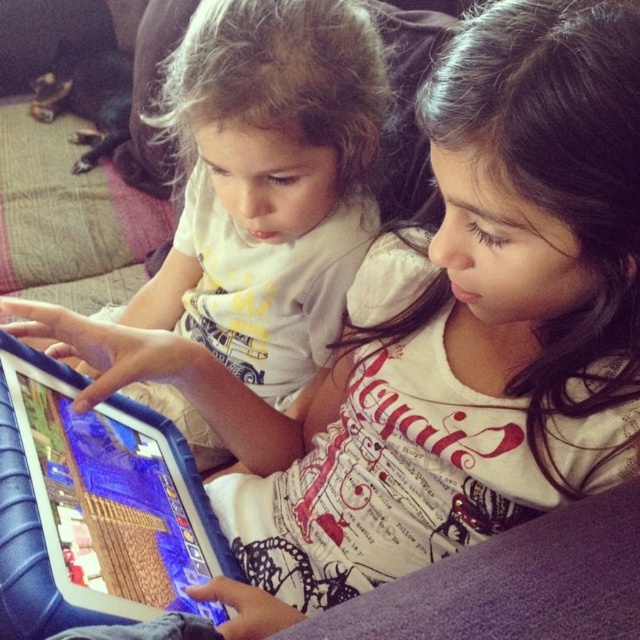
From the picture: Does matte white shirt at center have a lesser width compared to blue rubberized tablet at center?

No.

Which of these two, matte white shirt at center or blue rubberized tablet at center, stands shorter?

Standing shorter between the two is blue rubberized tablet at center.

Who is more distant from viewer, [285,38] or [182,442]?

The point [182,442] is behind.

The width and height of the screenshot is (640, 640). Identify the location of matte white shirt at center. (268, 182).